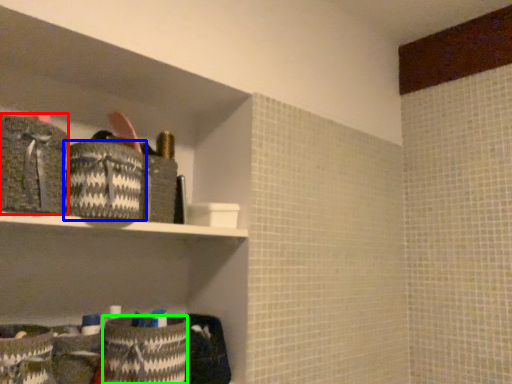
Question: Considering the real-world distances, which object is closest to material (highlighted by a red box)? material (highlighted by a blue box) or material (highlighted by a green box).

Choices:
 (A) material
 (B) material

Answer: (A)